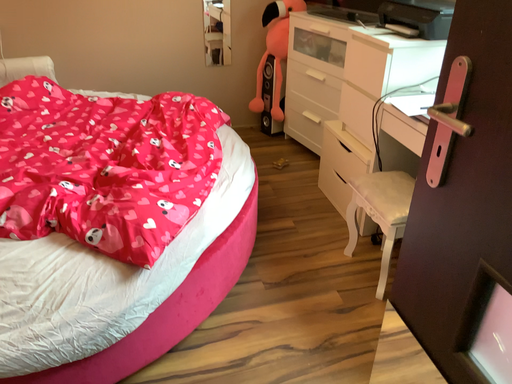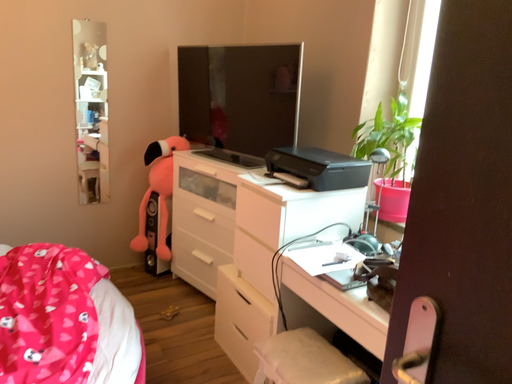
Question: Which way did the camera rotate in the video?

Choices:
 (A) rotated downward
 (B) rotated upward

Answer: (B)